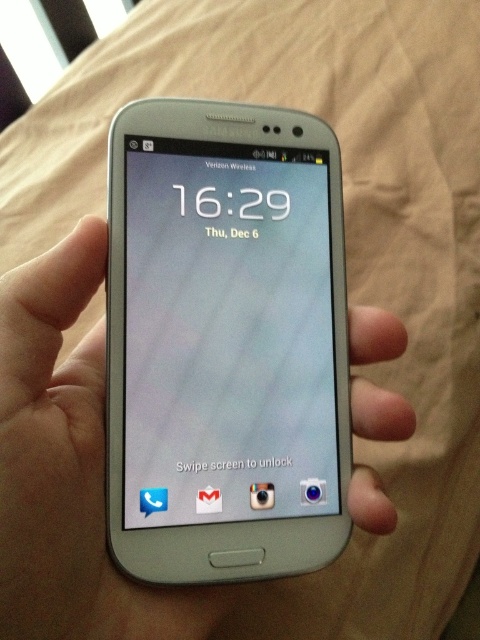
Which is behind, point (254, 456) or point (21, 474)?

Point (254, 456)

Can you confirm if satin silver phone at center is bigger than silver metallic phone at center?

Actually, satin silver phone at center might be smaller than silver metallic phone at center.

The width and height of the screenshot is (480, 640). I want to click on satin silver phone at center, so click(x=227, y=333).

Where is `satin silver phone at center`? The width and height of the screenshot is (480, 640). satin silver phone at center is located at coordinates (227, 333).